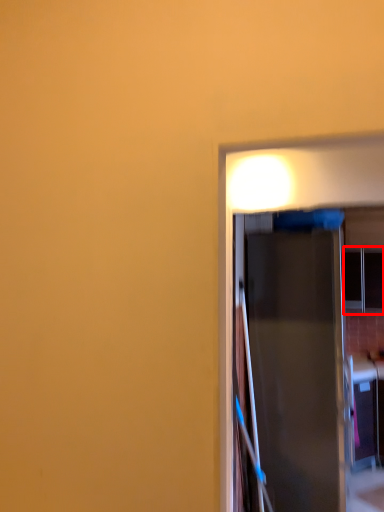
Question: Considering the relative positions of window (annotated by the red box) and door in the image provided, where is window (annotated by the red box) located with respect to the staircase?

Choices:
 (A) left
 (B) right

Answer: (B)